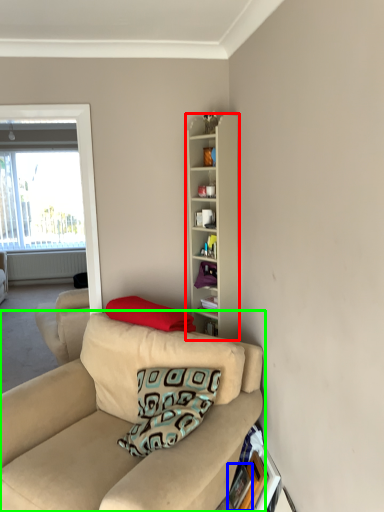
Question: Which is nearer to the cabinetry (highlighted by a red box)? picture frame (highlighted by a blue box) or studio couch (highlighted by a green box).

Choices:
 (A) picture frame
 (B) studio couch

Answer: (B)